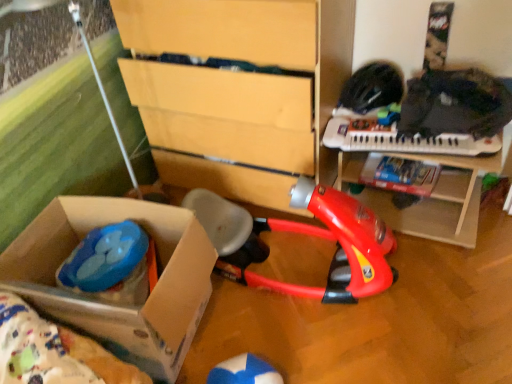
Question: Would you say wooden toy table at center is outside cardboard box at lower left?

Choices:
 (A) no
 (B) yes

Answer: (B)

Question: Considering the relative positions of wooden toy table at center and cardboard box at lower left in the image provided, is wooden toy table at center to the left of cardboard box at lower left from the viewer's perspective?

Choices:
 (A) no
 (B) yes

Answer: (A)

Question: Does wooden toy table at center contain cardboard box at lower left?

Choices:
 (A) yes
 (B) no

Answer: (B)

Question: From the image's perspective, does wooden toy table at center appear higher than cardboard box at lower left?

Choices:
 (A) no
 (B) yes

Answer: (B)

Question: Is the depth of wooden toy table at center less than that of cardboard box at lower left?

Choices:
 (A) yes
 (B) no

Answer: (B)

Question: Considering their positions, is blue plastic toy at lower left, which is the first toy from left to right, located in front of or behind red plastic vacuum cleaner at center, placed as the second toy when sorted from left to right?

Choices:
 (A) behind
 (B) front

Answer: (A)

Question: From their relative heights in the image, would you say blue plastic toy at lower left, which is the first toy from left to right, is taller or shorter than red plastic vacuum cleaner at center, the 1th toy positioned from the right?

Choices:
 (A) short
 (B) tall

Answer: (A)

Question: From the image's perspective, relative to red plastic vacuum cleaner at center, the 1th toy positioned from the right, is blue plastic toy at lower left, which is the first toy from left to right, above or below?

Choices:
 (A) below
 (B) above

Answer: (A)

Question: Would you say blue plastic toy at lower left, which is the second toy from right to left, is inside or outside red plastic vacuum cleaner at center, the 1th toy positioned from the right?

Choices:
 (A) outside
 (B) inside

Answer: (A)

Question: From the image's perspective, is matte yellow chest of drawers at center above or below blue plastic toy at lower left, which is the second toy from right to left?

Choices:
 (A) above
 (B) below

Answer: (A)

Question: Is matte yellow chest of drawers at center taller or shorter than blue plastic toy at lower left, which is the second toy from right to left?

Choices:
 (A) short
 (B) tall

Answer: (B)

Question: Considering the relative positions of matte yellow chest of drawers at center and blue plastic toy at lower left, which is the first toy from left to right, in the image provided, is matte yellow chest of drawers at center to the left or to the right of blue plastic toy at lower left, which is the first toy from left to right,?

Choices:
 (A) left
 (B) right

Answer: (B)

Question: From a real-world perspective, is matte yellow chest of drawers at center positioned above or below blue plastic toy at lower left, which is the first toy from left to right?

Choices:
 (A) below
 (B) above

Answer: (B)

Question: Does point (321, 228) appear closer or farther from the camera than point (349, 125)?

Choices:
 (A) farther
 (B) closer

Answer: (A)

Question: Considering the positions of red plastic vacuum cleaner at center, the 1th toy positioned from the right, and white plastic keyboard at upper right in the image, is red plastic vacuum cleaner at center, the 1th toy positioned from the right, bigger or smaller than white plastic keyboard at upper right?

Choices:
 (A) small
 (B) big

Answer: (B)